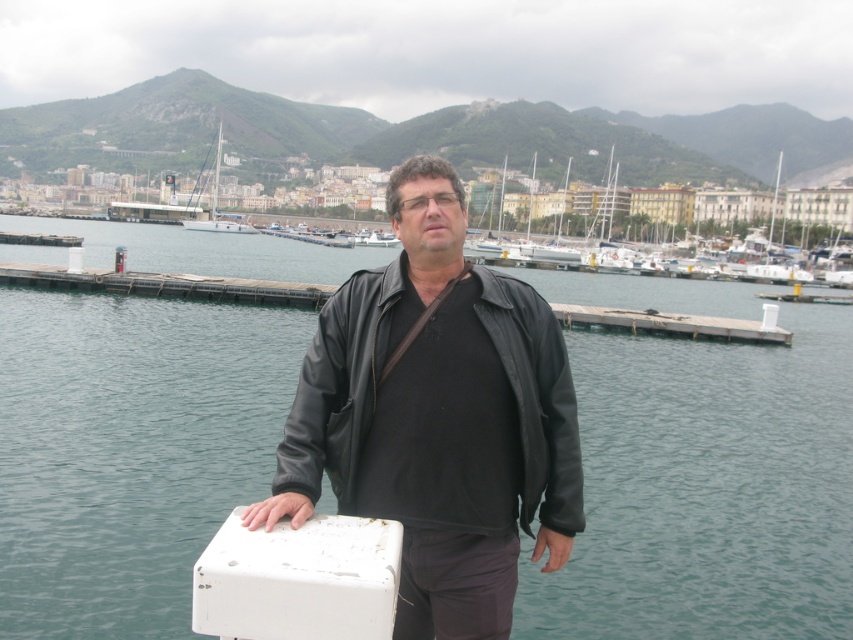
You are a photographer trying to capture the man in the black leather jacket at center and the white glossy sailboat at upper left in the same frame. Given their sizes, which object will appear smaller in the photo?

The black leather jacket at center will appear smaller in the photo because it is not as tall as the white glossy sailboat at upper left.

Based on the scene description, where is the white plastic boat at upper right located in the image?

The white plastic boat at upper right is located at the upper right of the image, at coordinates approximately 0.389 on the x axis and 0.904 on the y axis.